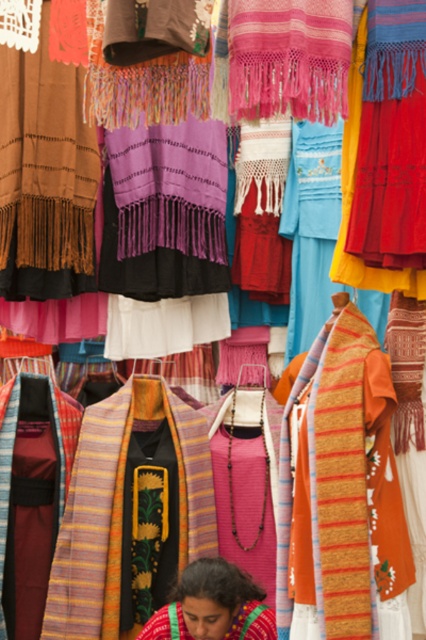
The image size is (426, 640). I want to click on embroidered fabric at lower center, so click(x=213, y=605).

Locate an element on the screen. This screenshot has width=426, height=640. embroidered fabric at lower center is located at coordinates (213, 605).